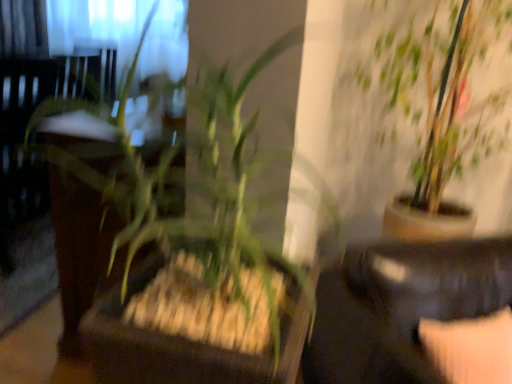
Question: Is green leafy plant at center, the 1th houseplant positioned from the front, not close to black leather couch at lower right?

Choices:
 (A) yes
 (B) no

Answer: (B)

Question: From a real-world perspective, is green leafy plant at center, which appears as the 2th houseplant when viewed from the back, physically below black leather couch at lower right?

Choices:
 (A) yes
 (B) no

Answer: (B)

Question: From the image's perspective, is green leafy plant at center, positioned as the 1th houseplant in left-to-right order, above black leather couch at lower right?

Choices:
 (A) yes
 (B) no

Answer: (A)

Question: Would you say black leather couch at lower right is part of green leafy plant at center, the 2th houseplant viewed from the right,'s contents?

Choices:
 (A) no
 (B) yes

Answer: (A)

Question: Is green leafy plant at center, which appears as the 2th houseplant when viewed from the back, smaller than black leather couch at lower right?

Choices:
 (A) yes
 (B) no

Answer: (A)

Question: From a real-world perspective, is black leather couch at lower right positioned above or below velvet beige pillow at lower right?

Choices:
 (A) above
 (B) below

Answer: (B)

Question: From the image's perspective, is black leather couch at lower right positioned above or below velvet beige pillow at lower right?

Choices:
 (A) above
 (B) below

Answer: (B)

Question: Based on their positions, is black leather couch at lower right located to the left or right of velvet beige pillow at lower right?

Choices:
 (A) right
 (B) left

Answer: (A)

Question: Is black leather couch at lower right situated inside velvet beige pillow at lower right or outside?

Choices:
 (A) inside
 (B) outside

Answer: (B)

Question: Is point (232, 39) closer or farther from the camera than point (448, 274)?

Choices:
 (A) closer
 (B) farther

Answer: (A)

Question: Looking at the image, does green leafy plant at center, the 2th houseplant viewed from the right, seem bigger or smaller compared to black leather couch at lower right?

Choices:
 (A) big
 (B) small

Answer: (B)

Question: In the image, is green leafy plant at center, which appears as the 2th houseplant when viewed from the back, positioned in front of or behind black leather couch at lower right?

Choices:
 (A) behind
 (B) front

Answer: (B)

Question: Considering the positions of green leafy plant at center, which appears as the 2th houseplant when viewed from the back, and black leather couch at lower right in the image, is green leafy plant at center, which appears as the 2th houseplant when viewed from the back, wider or thinner than black leather couch at lower right?

Choices:
 (A) thin
 (B) wide

Answer: (A)

Question: From the image's perspective, is velvet beige pillow at lower right above or below green leafy plant at upper right, the second houseplant in the front-to-back sequence?

Choices:
 (A) above
 (B) below

Answer: (B)

Question: Considering the positions of velvet beige pillow at lower right and green leafy plant at upper right, acting as the first houseplant starting from the right, in the image, is velvet beige pillow at lower right bigger or smaller than green leafy plant at upper right, acting as the first houseplant starting from the right,?

Choices:
 (A) small
 (B) big

Answer: (A)